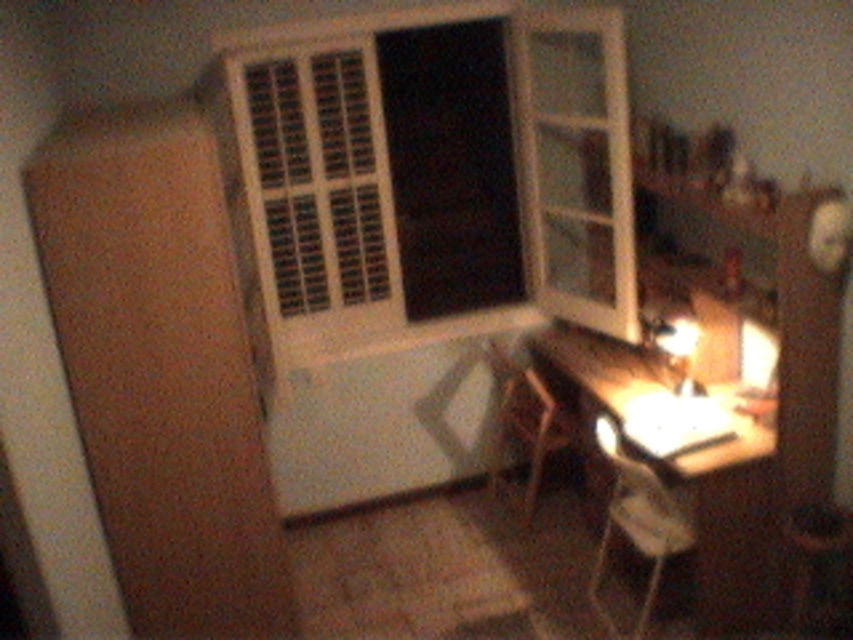
Question: Can you confirm if wooden chair at lower right is positioned above white glossy lamp at lower right?

Choices:
 (A) no
 (B) yes

Answer: (A)

Question: From the image, what is the correct spatial relationship of white plastic chair at lower right in relation to wooden stool at lower right?

Choices:
 (A) below
 (B) above

Answer: (B)

Question: Is white plastic chair at lower right smaller than white glossy lamp at lower right?

Choices:
 (A) no
 (B) yes

Answer: (A)

Question: Which point is farther from the camera taking this photo?

Choices:
 (A) (543, 465)
 (B) (651, 340)

Answer: (A)

Question: Based on their relative distances, which object is nearer to the wooden stool at lower right?

Choices:
 (A) white glossy lamp at lower right
 (B) white plastic chair at lower right
 (C) wooden desk at lower right
 (D) wooden chair at lower right

Answer: (C)

Question: Among these points, which one is farthest from the camera?

Choices:
 (A) (643, 461)
 (B) (502, 420)

Answer: (B)